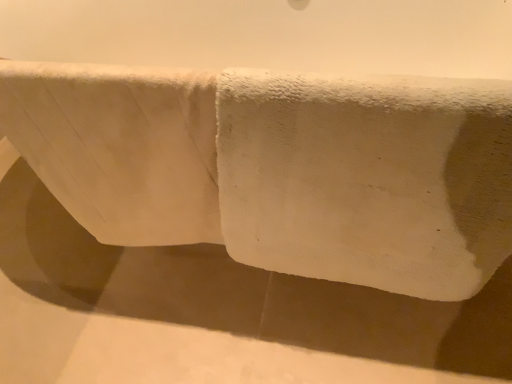
Question: Is white soft towel at center outside white fluffy towel at upper center?

Choices:
 (A) no
 (B) yes

Answer: (B)

Question: From the image's perspective, is white soft towel at center over white fluffy towel at upper center?

Choices:
 (A) yes
 (B) no

Answer: (A)

Question: Can you confirm if white soft towel at center is wider than white fluffy towel at upper center?

Choices:
 (A) yes
 (B) no

Answer: (A)

Question: Is white soft towel at center at the right side of white fluffy towel at upper center?

Choices:
 (A) yes
 (B) no

Answer: (A)

Question: Is the position of white soft towel at center more distant than that of white fluffy towel at upper center?

Choices:
 (A) yes
 (B) no

Answer: (B)

Question: Is white soft towel at center to the left of white fluffy towel at upper center from the viewer's perspective?

Choices:
 (A) yes
 (B) no

Answer: (B)

Question: Would you say white soft towel at center is part of white fluffy towel at upper center's contents?

Choices:
 (A) yes
 (B) no

Answer: (B)

Question: Is white fluffy towel at upper center in front of white soft towel at center?

Choices:
 (A) yes
 (B) no

Answer: (B)

Question: Considering the relative positions of white fluffy towel at upper center and white soft towel at center in the image provided, is white fluffy towel at upper center behind white soft towel at center?

Choices:
 (A) yes
 (B) no

Answer: (A)

Question: Is white fluffy towel at upper center not inside white soft towel at center?

Choices:
 (A) yes
 (B) no

Answer: (B)

Question: From the image's perspective, does white fluffy towel at upper center appear lower than white soft towel at center?

Choices:
 (A) yes
 (B) no

Answer: (A)

Question: Is white fluffy towel at upper center wider than white soft towel at center?

Choices:
 (A) yes
 (B) no

Answer: (B)

Question: In terms of width, does white soft towel at center look wider or thinner when compared to white fluffy towel at upper center?

Choices:
 (A) wide
 (B) thin

Answer: (A)